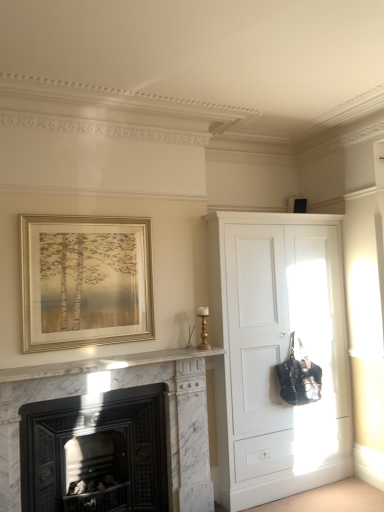
Question: Are white matte cupboard at right and gold metallic frame at upper left located far from each other?

Choices:
 (A) no
 (B) yes

Answer: (B)

Question: Can you confirm if white matte cupboard at right is taller than gold metallic frame at upper left?

Choices:
 (A) yes
 (B) no

Answer: (A)

Question: Does white matte cupboard at right lie in front of gold metallic frame at upper left?

Choices:
 (A) no
 (B) yes

Answer: (A)

Question: From the image's perspective, is white matte cupboard at right located beneath gold metallic frame at upper left?

Choices:
 (A) no
 (B) yes

Answer: (B)

Question: Considering the relative sizes of white matte cupboard at right and gold metallic frame at upper left in the image provided, is white matte cupboard at right wider than gold metallic frame at upper left?

Choices:
 (A) yes
 (B) no

Answer: (A)

Question: Is gold metallic frame at upper left wider or thinner than marble fireplace at lower left?

Choices:
 (A) thin
 (B) wide

Answer: (A)

Question: Is gold metallic frame at upper left taller or shorter than marble fireplace at lower left?

Choices:
 (A) short
 (B) tall

Answer: (A)

Question: Looking at the image, does gold metallic frame at upper left seem bigger or smaller compared to marble fireplace at lower left?

Choices:
 (A) small
 (B) big

Answer: (A)

Question: Choose the correct answer: Is gold metallic frame at upper left inside marble fireplace at lower left or outside it?

Choices:
 (A) inside
 (B) outside

Answer: (B)

Question: Is point (3, 465) closer or farther from the camera than point (299, 323)?

Choices:
 (A) closer
 (B) farther

Answer: (A)

Question: Looking at their shapes, would you say marble fireplace at lower left is wider or thinner than white matte cupboard at right?

Choices:
 (A) thin
 (B) wide

Answer: (A)

Question: Is marble fireplace at lower left in front of or behind white matte cupboard at right in the image?

Choices:
 (A) behind
 (B) front

Answer: (B)

Question: From the image's perspective, is marble fireplace at lower left located above or below white matte cupboard at right?

Choices:
 (A) above
 (B) below

Answer: (B)

Question: Is gold metallic frame at upper left inside or outside of white matte cupboard at right?

Choices:
 (A) outside
 (B) inside

Answer: (A)

Question: Does point (124, 284) appear closer or farther from the camera than point (304, 272)?

Choices:
 (A) closer
 (B) farther

Answer: (A)